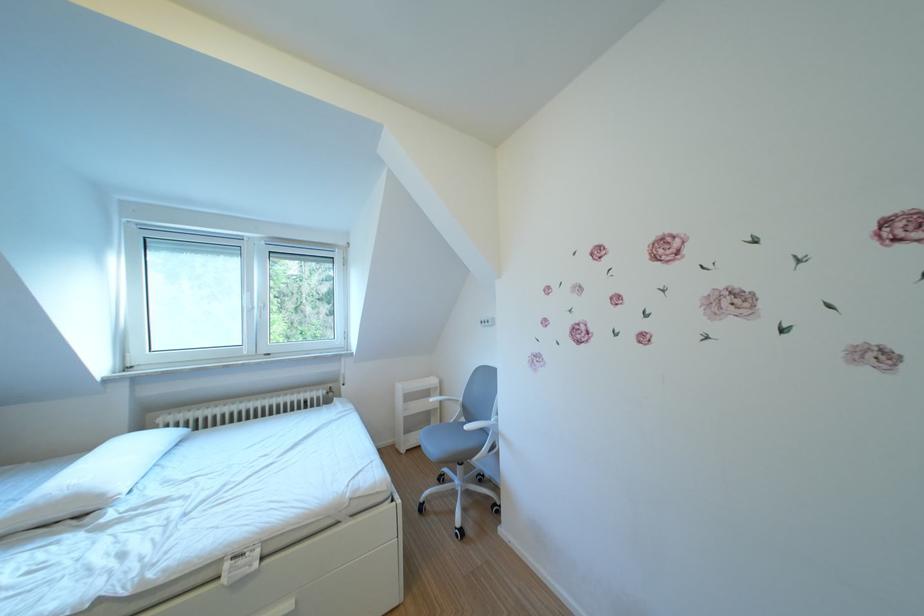
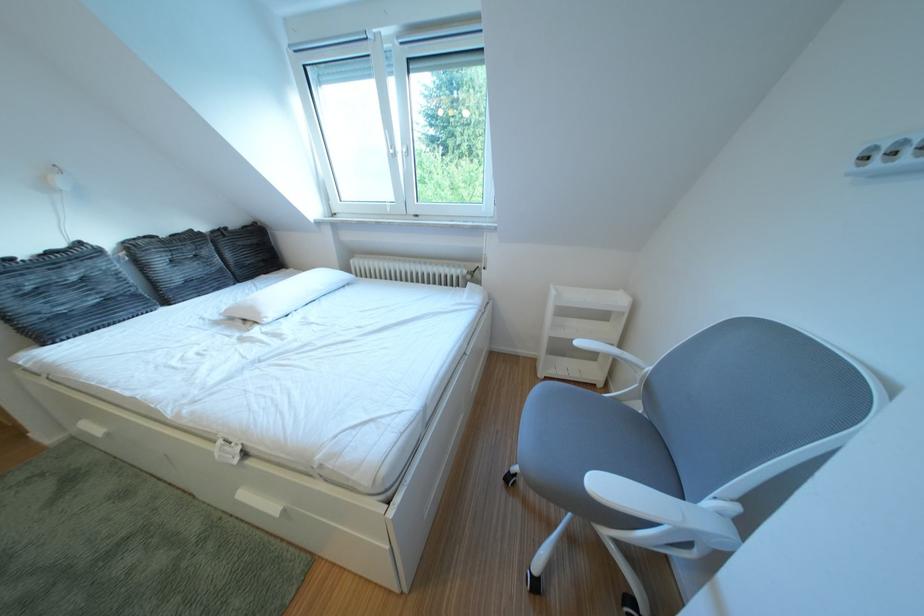
The point at [115,501] is marked in the first image. Where is the corresponding point in the second image?

(273, 318)